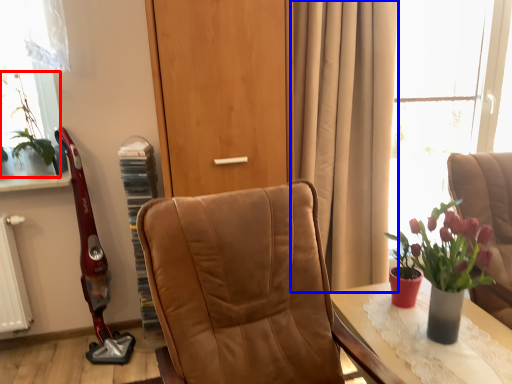
Question: Which object is closer to the camera taking this photo, houseplant (highlighted by a red box) or curtain (highlighted by a blue box)?

Choices:
 (A) houseplant
 (B) curtain

Answer: (B)